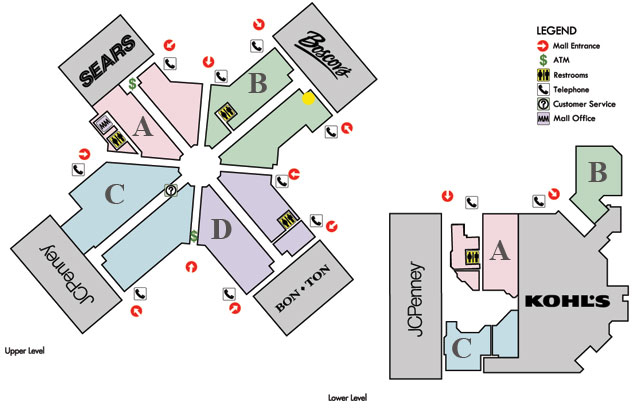
Locate an element on the screen. This screenshot has height=410, width=640. restroom is located at coordinates (285, 216), (476, 255), (226, 107), (116, 138).